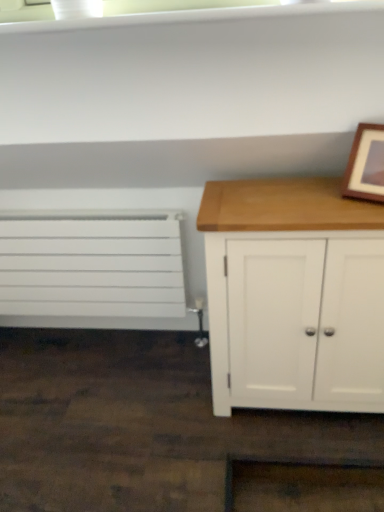
Question: From the image's perspective, is wooden picture frame at upper right over white matte radiator at left?

Choices:
 (A) yes
 (B) no

Answer: (A)

Question: From a real-world perspective, is wooden picture frame at upper right below white matte radiator at left?

Choices:
 (A) yes
 (B) no

Answer: (B)

Question: Is white matte radiator at left located within wooden picture frame at upper right?

Choices:
 (A) yes
 (B) no

Answer: (B)

Question: Considering the relative sizes of wooden picture frame at upper right and white matte radiator at left in the image provided, is wooden picture frame at upper right wider than white matte radiator at left?

Choices:
 (A) yes
 (B) no

Answer: (A)

Question: From the image's perspective, is wooden picture frame at upper right beneath white matte radiator at left?

Choices:
 (A) yes
 (B) no

Answer: (B)

Question: Is the depth of wooden picture frame at upper right less than that of white matte radiator at left?

Choices:
 (A) no
 (B) yes

Answer: (B)

Question: Does white matte radiator at left turn towards white wood cabinet at right?

Choices:
 (A) yes
 (B) no

Answer: (B)

Question: From a real-world perspective, is white matte radiator at left located higher than white wood cabinet at right?

Choices:
 (A) yes
 (B) no

Answer: (B)

Question: Is white matte radiator at left taller than white wood cabinet at right?

Choices:
 (A) yes
 (B) no

Answer: (B)

Question: Considering the relative sizes of white matte radiator at left and white wood cabinet at right in the image provided, is white matte radiator at left bigger than white wood cabinet at right?

Choices:
 (A) no
 (B) yes

Answer: (A)

Question: Is white matte radiator at left smaller than white wood cabinet at right?

Choices:
 (A) yes
 (B) no

Answer: (A)

Question: Can you confirm if white matte radiator at left is positioned to the right of white wood cabinet at right?

Choices:
 (A) no
 (B) yes

Answer: (A)

Question: Is white wood cabinet at right taller than white matte radiator at left?

Choices:
 (A) no
 (B) yes

Answer: (B)